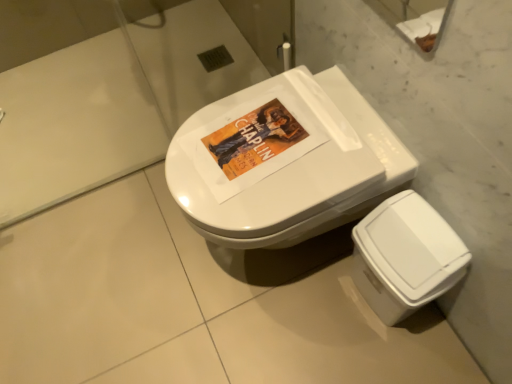
Question: From a real-world perspective, is white plastic bidet at lower right above or below white glossy toilet at center?

Choices:
 (A) above
 (B) below

Answer: (B)

Question: From the image's perspective, is white plastic bidet at lower right above or below white glossy toilet at center?

Choices:
 (A) above
 (B) below

Answer: (B)

Question: In the image, is white plastic bidet at lower right on the left side or the right side of white glossy toilet at center?

Choices:
 (A) right
 (B) left

Answer: (A)

Question: Which is correct: white glossy toilet at center is inside white plastic bidet at lower right, or outside of it?

Choices:
 (A) inside
 (B) outside

Answer: (B)

Question: Considering the positions of white glossy toilet at center and white plastic bidet at lower right in the image, is white glossy toilet at center bigger or smaller than white plastic bidet at lower right?

Choices:
 (A) big
 (B) small

Answer: (A)

Question: Looking at their shapes, would you say white glossy toilet at center is wider or thinner than white plastic bidet at lower right?

Choices:
 (A) wide
 (B) thin

Answer: (A)

Question: Is white glossy toilet at center to the left or to the right of white plastic bidet at lower right in the image?

Choices:
 (A) left
 (B) right

Answer: (A)